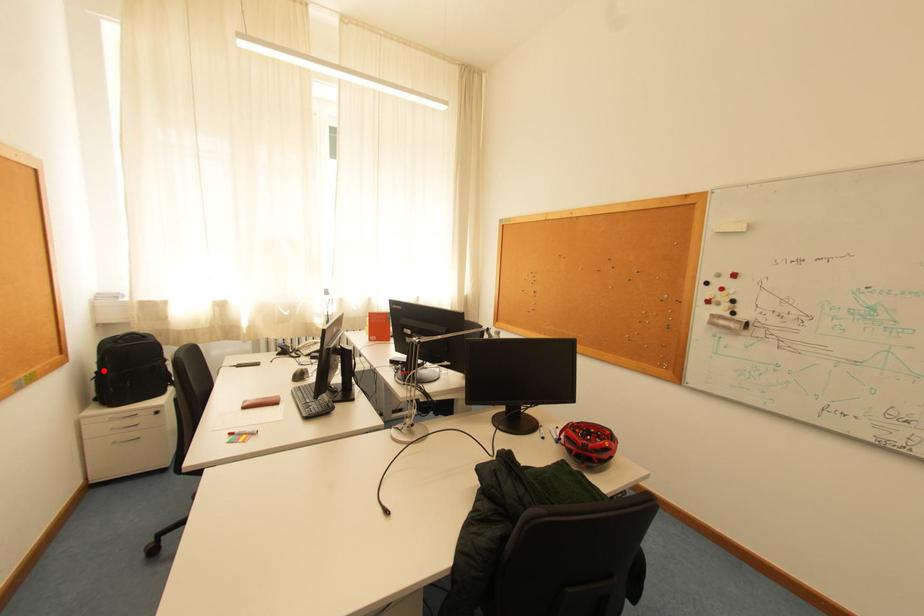
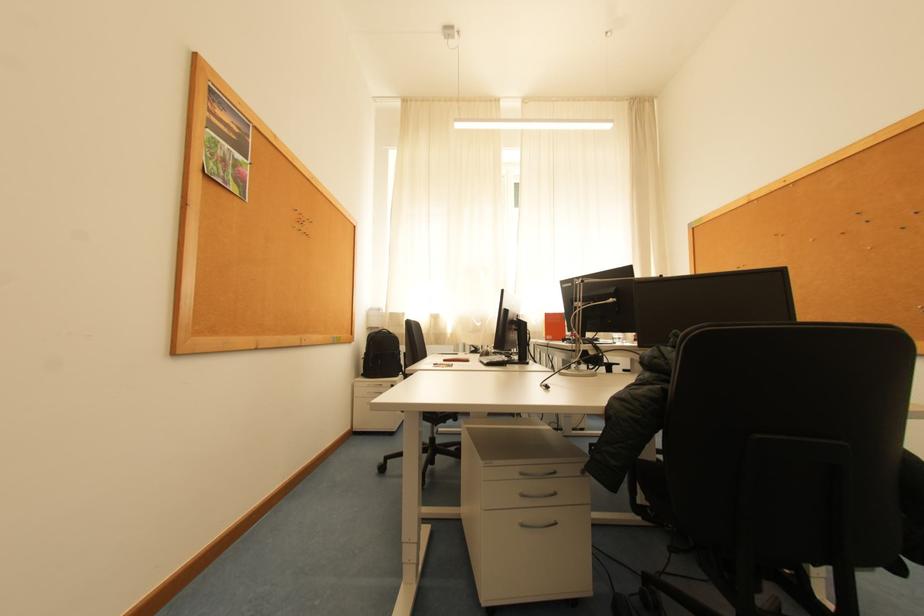
The point at the highlighted location is marked in the first image. Where is the corresponding point in the second image?

(372, 353)